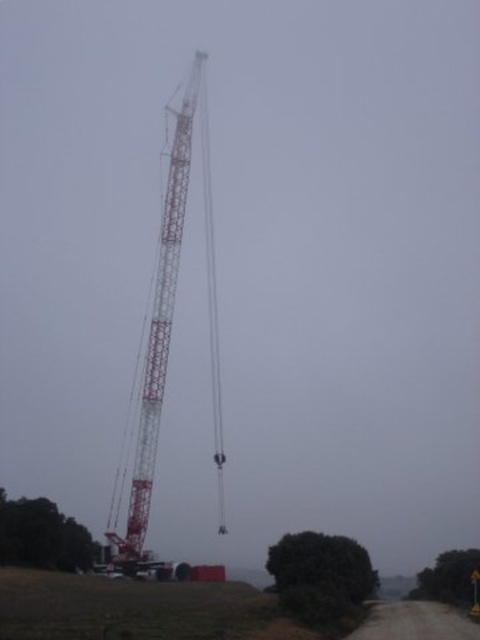
Who is lower down, white metallic crane at center or metallic red crane at center?

metallic red crane at center is lower down.

The width and height of the screenshot is (480, 640). In order to click on white metallic crane at center in this screenshot , I will do `click(167, 340)`.